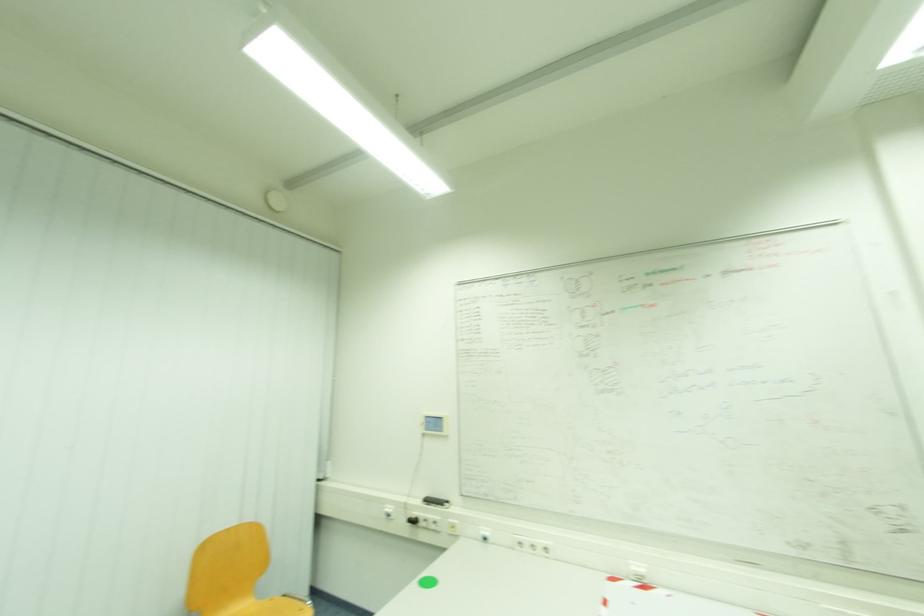
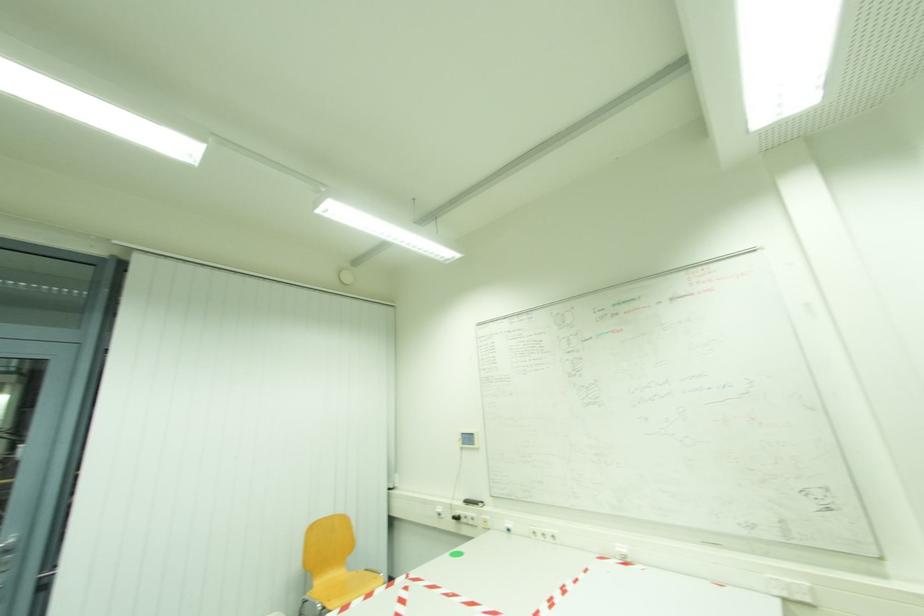
In a continuous first-person perspective shot, in which direction is the camera moving?

The cameraman walked toward right, backward.